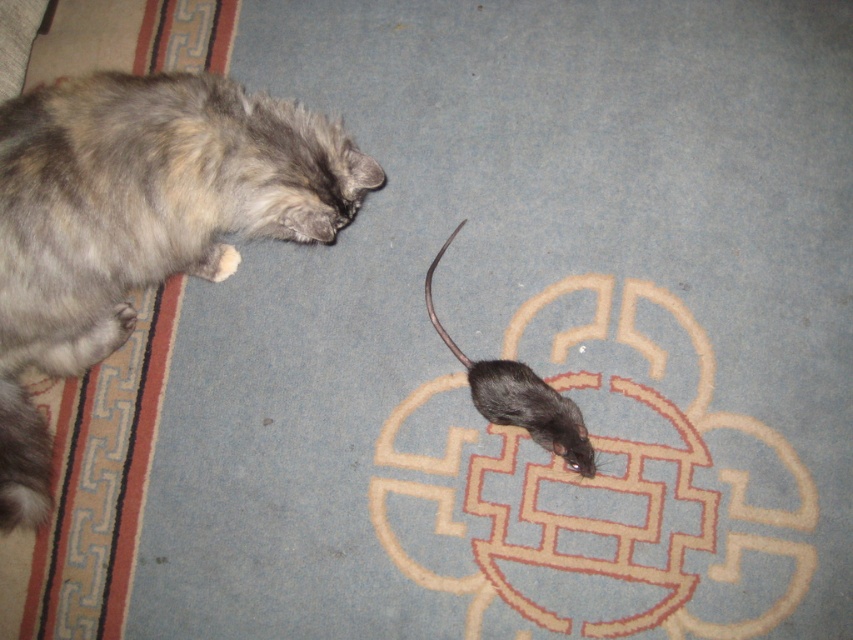
Does gray fluffy cat at left have a greater height compared to black matte mouse at center?

Yes.

Does gray fluffy cat at left lie behind black matte mouse at center?

No, it is not.

This screenshot has width=853, height=640. What do you see at coordinates (138, 220) in the screenshot?
I see `gray fluffy cat at left` at bounding box center [138, 220].

You are a GUI agent. You are given a task and a screenshot of the screen. Output one action in this format:
    pyautogui.click(x=<x>, y=<y>)
    Task: Click on the gray fluffy cat at left
    The image size is (853, 640).
    Given the screenshot: What is the action you would take?
    pyautogui.click(x=138, y=220)